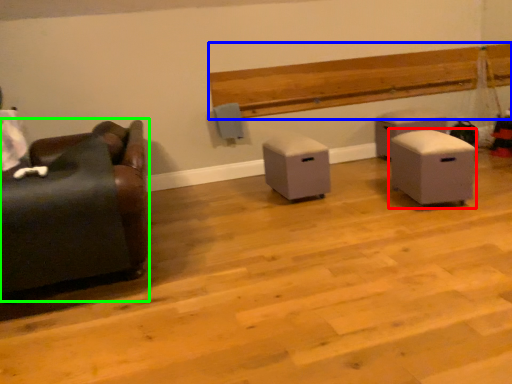
Question: Which object is positioned closest to furniture (highlighted by a red box)? Select from hardwood (highlighted by a blue box) and furniture (highlighted by a green box).

Choices:
 (A) hardwood
 (B) furniture

Answer: (A)